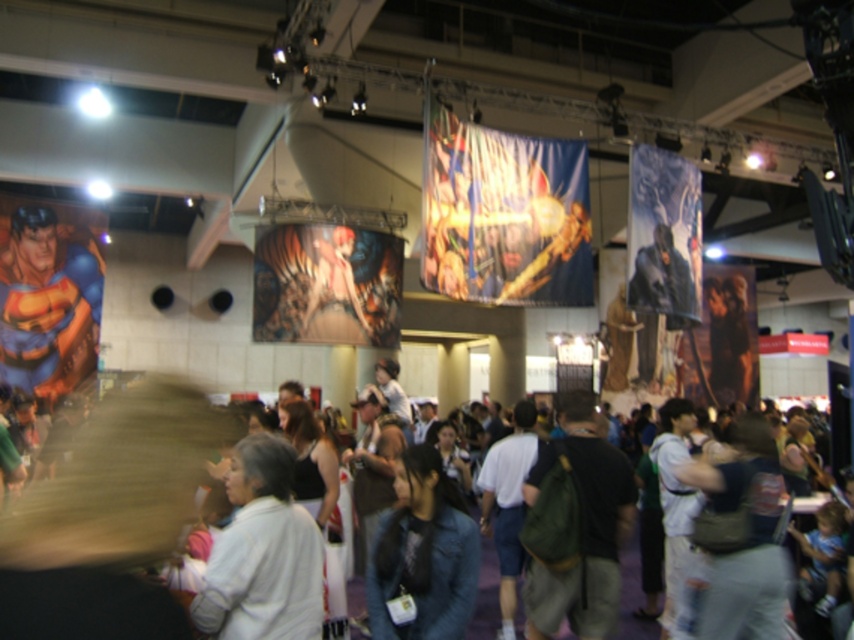
Question: Among these points, which one is farthest from the camera?

Choices:
 (A) (219, 556)
 (B) (145, 528)

Answer: (A)

Question: Estimate the real-world distances between objects in this image. Which object is closer to the white cotton shirt at center?

Choices:
 (A) white fabric at center
 (B) denim jacket at center
 (C) matte blue suit at left

Answer: (A)

Question: Does white cotton shirt at center appear on the left side of white fabric at center?

Choices:
 (A) no
 (B) yes

Answer: (A)

Question: Does matte blue suit at left appear under denim jacket at center?

Choices:
 (A) yes
 (B) no

Answer: (B)

Question: Does white cotton shirt at center lie in front of denim jacket at center?

Choices:
 (A) no
 (B) yes

Answer: (B)

Question: Which point appears closest to the camera in this image?

Choices:
 (A) (57, 253)
 (B) (161, 433)

Answer: (B)